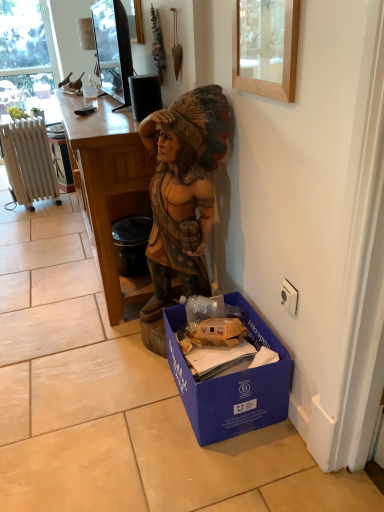
Question: Is wooden frame at upper center shorter than blue cardboard box at lower right?

Choices:
 (A) no
 (B) yes

Answer: (B)

Question: Can we say wooden frame at upper center lies outside blue cardboard box at lower right?

Choices:
 (A) yes
 (B) no

Answer: (A)

Question: Does wooden frame at upper center have a lesser width compared to blue cardboard box at lower right?

Choices:
 (A) no
 (B) yes

Answer: (B)

Question: Considering the relative sizes of wooden frame at upper center and blue cardboard box at lower right in the image provided, is wooden frame at upper center wider than blue cardboard box at lower right?

Choices:
 (A) yes
 (B) no

Answer: (B)

Question: Is wooden frame at upper center smaller than blue cardboard box at lower right?

Choices:
 (A) no
 (B) yes

Answer: (B)

Question: Is wooden frame at upper center not close to blue cardboard box at lower right?

Choices:
 (A) yes
 (B) no

Answer: (B)

Question: Is wooden statue at center thinner than wooden desk at center?

Choices:
 (A) no
 (B) yes

Answer: (B)

Question: From the image's perspective, is wooden statue at center below wooden desk at center?

Choices:
 (A) no
 (B) yes

Answer: (B)

Question: Does wooden statue at center have a greater height compared to wooden desk at center?

Choices:
 (A) yes
 (B) no

Answer: (A)

Question: Does wooden statue at center have a smaller size compared to wooden desk at center?

Choices:
 (A) no
 (B) yes

Answer: (B)

Question: Is wooden statue at center next to wooden desk at center and touching it?

Choices:
 (A) no
 (B) yes

Answer: (A)

Question: Considering the relative positions of wooden statue at center and wooden desk at center in the image provided, is wooden statue at center to the left of wooden desk at center from the viewer's perspective?

Choices:
 (A) yes
 (B) no

Answer: (B)

Question: Is white painted metal radiator at left placed right next to black glossy tv at upper center?

Choices:
 (A) no
 (B) yes

Answer: (A)